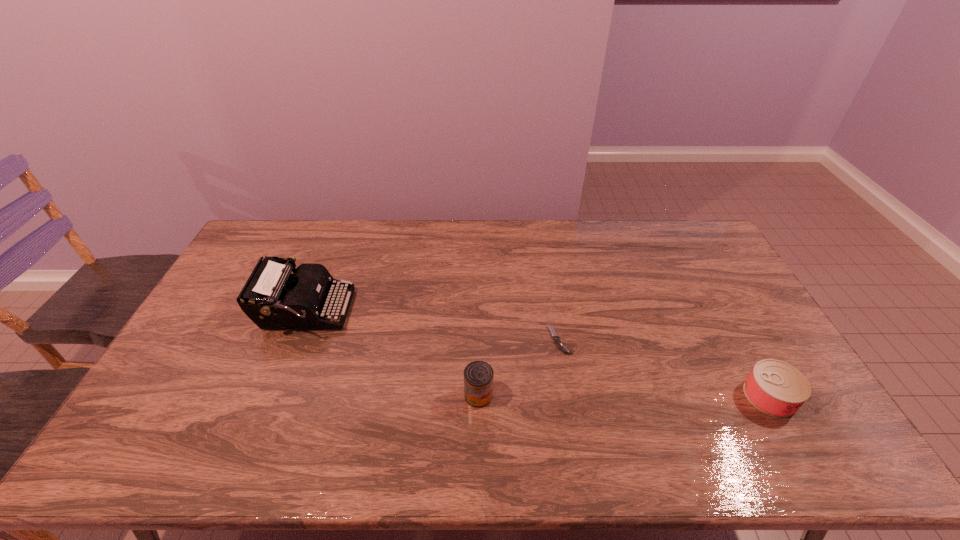
Locate an element on the screen. The image size is (960, 540). typewriter is located at coordinates (273, 298).

What are the coordinates of `the leftmost object` in the screenshot? It's located at (273, 298).

Where is `the third object from right to left`? The height and width of the screenshot is (540, 960). the third object from right to left is located at coordinates (478, 376).

In order to click on the left can in this screenshot , I will do `click(478, 376)`.

You are a GUI agent. You are given a task and a screenshot of the screen. Output one action in this format:
    pyautogui.click(x=<x>, y=<y>)
    Task: Click on the right can
    This screenshot has width=960, height=540.
    Given the screenshot: What is the action you would take?
    pyautogui.click(x=776, y=388)

This screenshot has width=960, height=540. I want to click on the third tallest object, so click(776, 388).

Where is `the second object from right to left`? the second object from right to left is located at coordinates (556, 338).

The height and width of the screenshot is (540, 960). I want to click on the shortest object, so click(556, 338).

This screenshot has height=540, width=960. I want to click on free spot located 0.150m on the typing side of the typewriter, so click(x=396, y=311).

Where is `vacant space located 0.400m on the right of the left can`? The width and height of the screenshot is (960, 540). vacant space located 0.400m on the right of the left can is located at coordinates (642, 395).